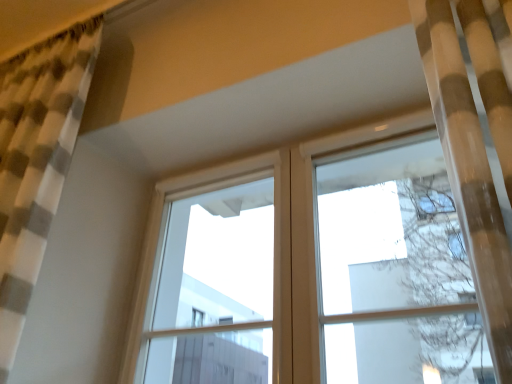
Question: Can you confirm if white plastic window frame at upper center is positioned to the left of checkered fabric curtain at left?

Choices:
 (A) no
 (B) yes

Answer: (A)

Question: Is white plastic window frame at upper center turned away from checkered fabric curtain at left?

Choices:
 (A) yes
 (B) no

Answer: (B)

Question: From a real-world perspective, is white plastic window frame at upper center physically below checkered fabric curtain at left?

Choices:
 (A) no
 (B) yes

Answer: (B)

Question: From the image's perspective, would you say white plastic window frame at upper center is shown under checkered fabric curtain at left?

Choices:
 (A) yes
 (B) no

Answer: (A)

Question: Does white plastic window frame at upper center have a smaller size compared to checkered fabric curtain at left?

Choices:
 (A) no
 (B) yes

Answer: (B)

Question: From the image's perspective, does white plastic window frame at upper center appear higher than checkered fabric curtain at left?

Choices:
 (A) yes
 (B) no

Answer: (B)

Question: From the image's perspective, is checkered fabric curtain at left below white plastic window frame at upper center?

Choices:
 (A) yes
 (B) no

Answer: (B)

Question: Is checkered fabric curtain at left surrounding white plastic window frame at upper center?

Choices:
 (A) yes
 (B) no

Answer: (B)

Question: Does checkered fabric curtain at left lie behind white plastic window frame at upper center?

Choices:
 (A) no
 (B) yes

Answer: (A)

Question: Is checkered fabric curtain at left directly adjacent to white plastic window frame at upper center?

Choices:
 (A) no
 (B) yes

Answer: (A)

Question: Is checkered fabric curtain at left to the right of white plastic window frame at upper center from the viewer's perspective?

Choices:
 (A) no
 (B) yes

Answer: (A)

Question: Is checkered fabric curtain at left turned away from white plastic window frame at upper center?

Choices:
 (A) yes
 (B) no

Answer: (B)

Question: Based on their sizes in the image, would you say white plastic window frame at upper center is bigger or smaller than checkered fabric curtain at left?

Choices:
 (A) small
 (B) big

Answer: (A)